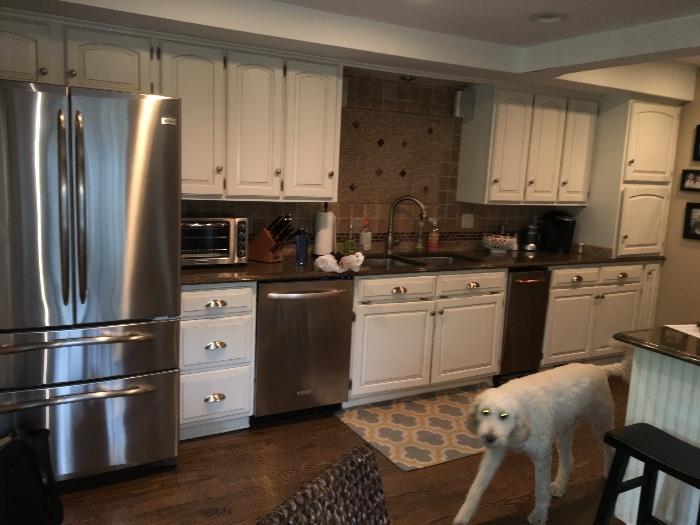
At what (x,y) coordinates should I click in order to perform the action: click on barstool. Please return your answer as a coordinate pair (x, y). This screenshot has height=525, width=700. Looking at the image, I should click on (672, 462).